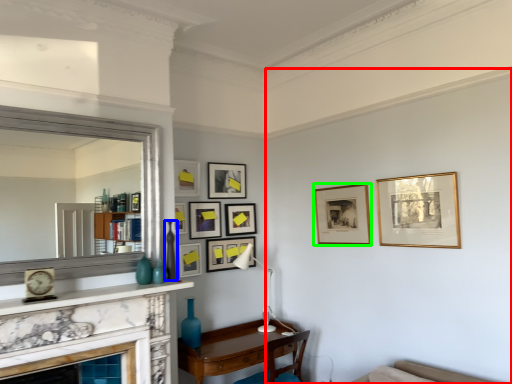
Question: Which is nearer to the backdrop (highlighted by a red box)? vase (highlighted by a blue box) or picture frame (highlighted by a green box).

Choices:
 (A) vase
 (B) picture frame

Answer: (B)